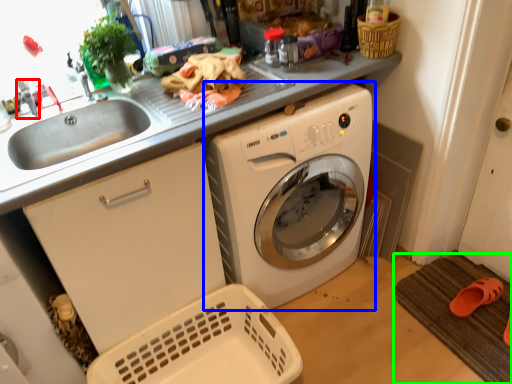
Question: Based on their relative distances, which object is farther from faucet (highlighted by a red box)? Choose from washing machine (highlighted by a blue box) and bath mat (highlighted by a green box).

Choices:
 (A) washing machine
 (B) bath mat

Answer: (B)